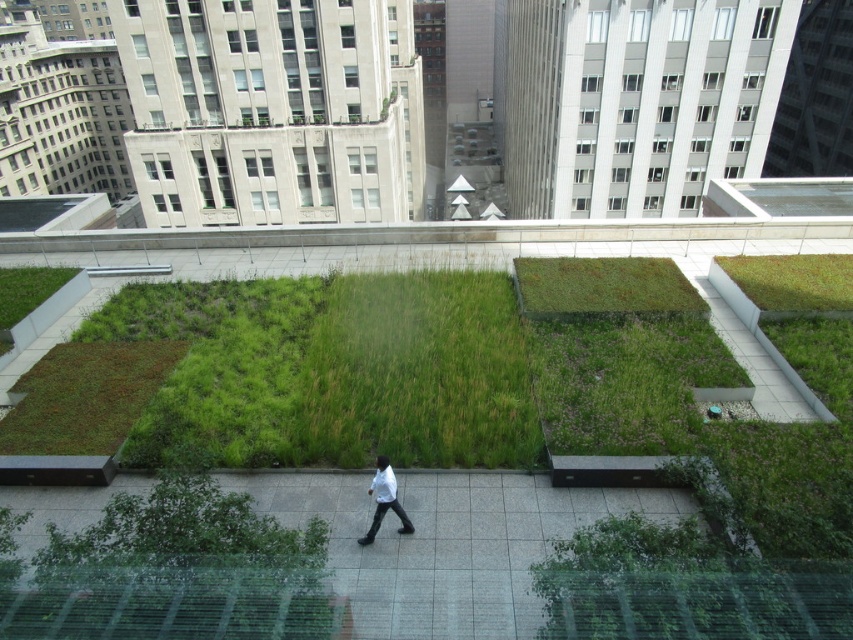
You are standing on the rooftop garden and want to take a photo of the white matte shirt at center without the green grass at upper right appearing in the background. Is this possible given their positions?

The green grass at upper right is positioned over the white matte shirt at center, so the green grass at upper right would block the background view behind the white matte shirt at center. Therefore, it might not be possible to take a photo of the white matte shirt at center without the green grass at upper right appearing in the background unless you move to a different angle or position.